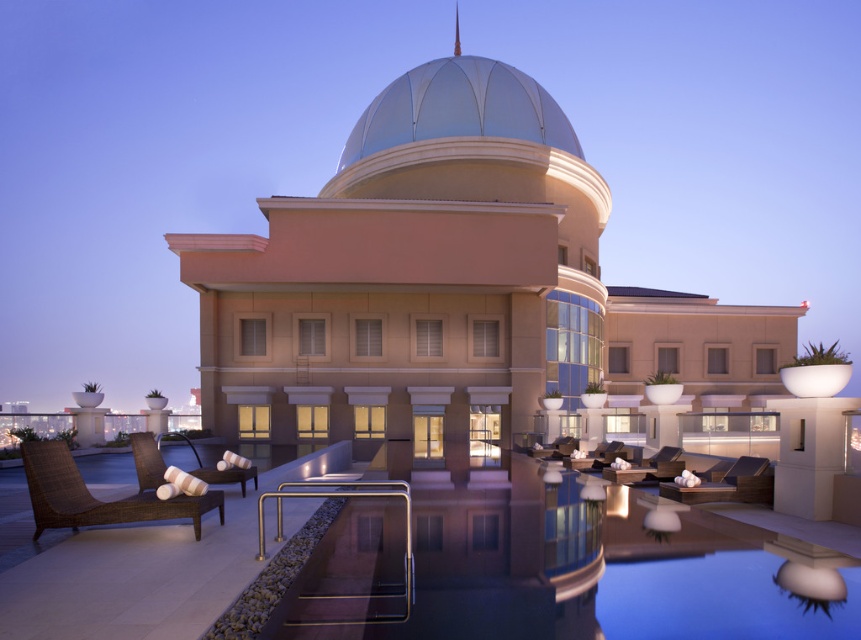
Question: Is beige stone building at center bigger than brown woven chair at center?

Choices:
 (A) no
 (B) yes

Answer: (B)

Question: From the image, what is the correct spatial relationship of metallic silver dome at center in relation to dark brown wicker lounge chair at center?

Choices:
 (A) right
 (B) left

Answer: (B)

Question: Estimate the real-world distances between objects in this image. Which object is farther from the beige stone building at center?

Choices:
 (A) smooth glass pool at center
 (B) metallic silver dome at center
 (C) white textured lounge chair at lower left

Answer: (A)

Question: Is white textured lounge chair at lower left bigger than dark brown wicker lounge chair at center?

Choices:
 (A) no
 (B) yes

Answer: (A)

Question: Among these points, which one is farthest from the camera?

Choices:
 (A) (612, 477)
 (B) (719, 483)

Answer: (A)

Question: Among these points, which one is nearest to the camera?

Choices:
 (A) (701, 600)
 (B) (645, 477)

Answer: (A)